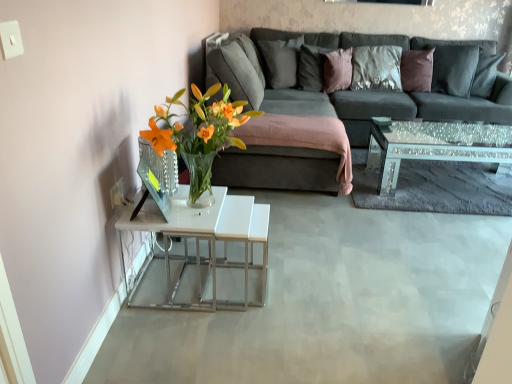
Question: Considering the relative positions of mirrored glass coffee table at right and dark gray fabric couch at center in the image provided, is mirrored glass coffee table at right to the left of dark gray fabric couch at center from the viewer's perspective?

Choices:
 (A) yes
 (B) no

Answer: (B)

Question: Are mirrored glass coffee table at right and dark gray fabric couch at center far apart?

Choices:
 (A) no
 (B) yes

Answer: (A)

Question: From a real-world perspective, is mirrored glass coffee table at right located beneath dark gray fabric couch at center?

Choices:
 (A) no
 (B) yes

Answer: (B)

Question: From the image's perspective, does mirrored glass coffee table at right appear lower than dark gray fabric couch at center?

Choices:
 (A) yes
 (B) no

Answer: (A)

Question: Is mirrored glass coffee table at right in front of dark gray fabric couch at center?

Choices:
 (A) no
 (B) yes

Answer: (A)

Question: Does mirrored glass coffee table at right come behind dark gray fabric couch at center?

Choices:
 (A) no
 (B) yes

Answer: (B)

Question: From a real-world perspective, is mirrored glass coffee table at right on top of pink velvet pillow at upper center, the third pillow viewed from the left?

Choices:
 (A) no
 (B) yes

Answer: (A)

Question: Considering the relative positions of mirrored glass coffee table at right and pink velvet pillow at upper center, the third pillow viewed from the left, in the image provided, is mirrored glass coffee table at right to the left of pink velvet pillow at upper center, the third pillow viewed from the left, from the viewer's perspective?

Choices:
 (A) no
 (B) yes

Answer: (A)

Question: Is mirrored glass coffee table at right bigger than pink velvet pillow at upper center, the third pillow viewed from the left?

Choices:
 (A) no
 (B) yes

Answer: (B)

Question: Is mirrored glass coffee table at right smaller than pink velvet pillow at upper center, positioned as the first pillow in right-to-left order?

Choices:
 (A) no
 (B) yes

Answer: (A)

Question: Considering the relative positions of mirrored glass coffee table at right and pink velvet pillow at upper center, the third pillow viewed from the left, in the image provided, is mirrored glass coffee table at right behind pink velvet pillow at upper center, the third pillow viewed from the left,?

Choices:
 (A) yes
 (B) no

Answer: (B)

Question: Is the depth of mirrored glass coffee table at right less than that of pink velvet pillow at upper center, the third pillow viewed from the left?

Choices:
 (A) no
 (B) yes

Answer: (B)

Question: Can you confirm if velvet gray pillow at upper center, which appears as the third pillow when viewed from the right, is taller than mirrored glass coffee table at right?

Choices:
 (A) no
 (B) yes

Answer: (B)